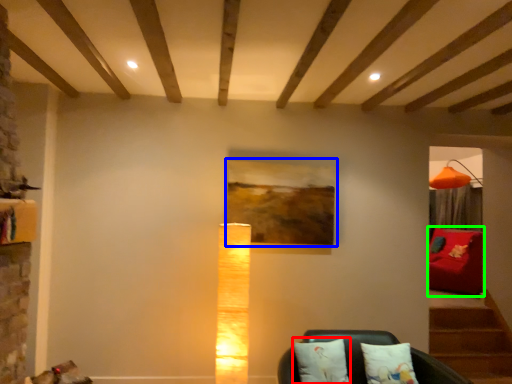
Question: Considering the real-world distances, which object is closest to pillow (highlighted by a red box)? picture frame (highlighted by a blue box) or furniture (highlighted by a green box).

Choices:
 (A) picture frame
 (B) furniture

Answer: (A)